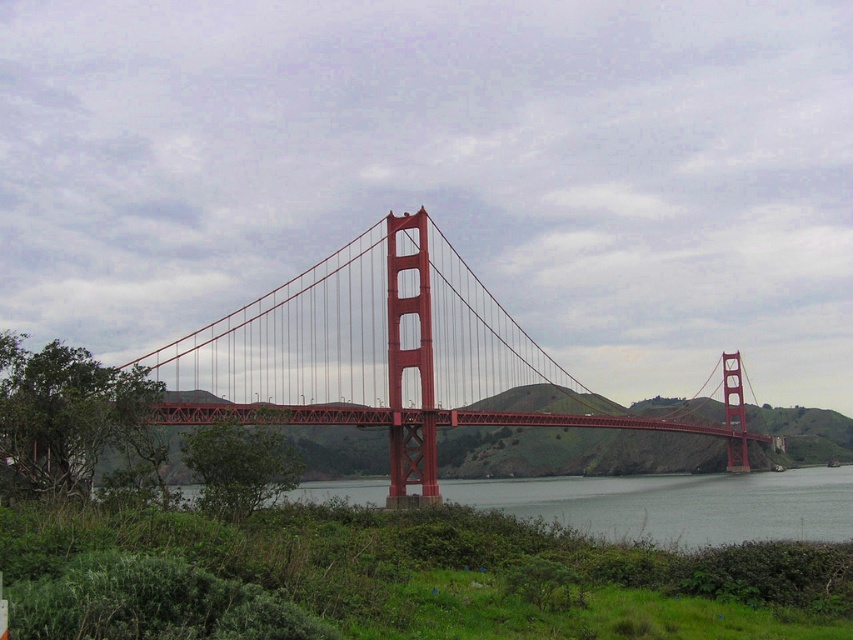
Question: Is metallic red suspension bridge at center wider than clear water at center?

Choices:
 (A) yes
 (B) no

Answer: (B)

Question: Which point is closer to the camera?

Choices:
 (A) 450,412
 (B) 756,512

Answer: (B)

Question: Is metallic red suspension bridge at center bigger than clear water at center?

Choices:
 (A) yes
 (B) no

Answer: (A)

Question: Is metallic red suspension bridge at center behind clear water at center?

Choices:
 (A) yes
 (B) no

Answer: (A)

Question: Which point is closer to the camera?

Choices:
 (A) (450, 298)
 (B) (735, 522)

Answer: (B)

Question: Which point is closer to the camera?

Choices:
 (A) (804, 509)
 (B) (408, 358)

Answer: (B)